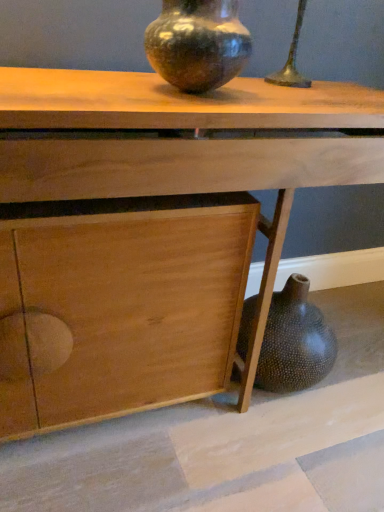
Question: From the image's perspective, is wooden table at center on speckled dark brown vase at upper center?

Choices:
 (A) no
 (B) yes

Answer: (A)

Question: Can you confirm if wooden table at center is positioned to the right of speckled dark brown vase at upper center?

Choices:
 (A) no
 (B) yes

Answer: (B)

Question: Does wooden table at center have a larger size compared to speckled dark brown vase at upper center?

Choices:
 (A) no
 (B) yes

Answer: (B)

Question: Can you confirm if wooden table at center is wider than speckled dark brown vase at upper center?

Choices:
 (A) yes
 (B) no

Answer: (A)

Question: Is wooden table at center oriented towards speckled dark brown vase at upper center?

Choices:
 (A) yes
 (B) no

Answer: (B)

Question: Is wooden table at center in contact with speckled dark brown vase at upper center?

Choices:
 (A) no
 (B) yes

Answer: (A)

Question: Is speckled dark brown vase at upper center smaller than wooden table at center?

Choices:
 (A) no
 (B) yes

Answer: (B)

Question: Does speckled dark brown vase at upper center have a greater width compared to wooden table at center?

Choices:
 (A) yes
 (B) no

Answer: (B)

Question: From the image's perspective, is speckled dark brown vase at upper center above wooden table at center?

Choices:
 (A) no
 (B) yes

Answer: (B)

Question: Considering the relative positions of speckled dark brown vase at upper center and wooden table at center in the image provided, is speckled dark brown vase at upper center to the right of wooden table at center from the viewer's perspective?

Choices:
 (A) yes
 (B) no

Answer: (B)

Question: Does speckled dark brown vase at upper center have a lesser height compared to wooden table at center?

Choices:
 (A) no
 (B) yes

Answer: (B)

Question: Can you confirm if speckled dark brown vase at upper center is thinner than wooden table at center?

Choices:
 (A) yes
 (B) no

Answer: (A)

Question: Is point (226, 12) closer or farther from the camera than point (6, 340)?

Choices:
 (A) closer
 (B) farther

Answer: (A)